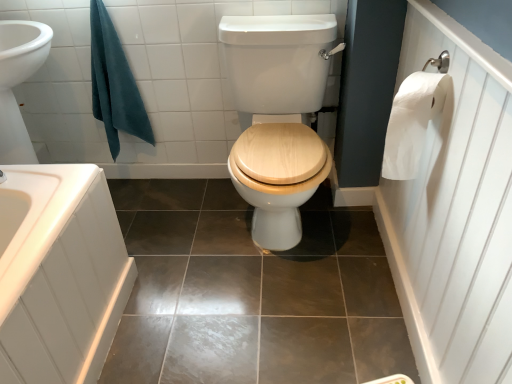
Identify the location of empty space that is ontop of white paper towel at right. Image resolution: width=512 pixels, height=384 pixels. (459, 22).